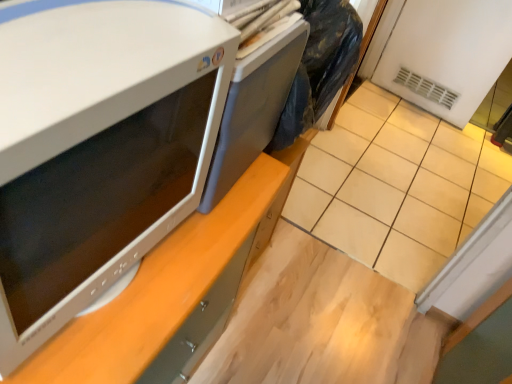
Question: Can you confirm if white glossy microwave at left is wider than satin gray desktop at center?

Choices:
 (A) no
 (B) yes

Answer: (A)

Question: Is white glossy microwave at left far from satin gray desktop at center?

Choices:
 (A) no
 (B) yes

Answer: (A)

Question: Is white glossy microwave at left to the right of satin gray desktop at center from the viewer's perspective?

Choices:
 (A) yes
 (B) no

Answer: (B)

Question: Is white glossy microwave at left with satin gray desktop at center?

Choices:
 (A) no
 (B) yes

Answer: (A)

Question: Could you tell me if white glossy microwave at left is turned towards satin gray desktop at center?

Choices:
 (A) yes
 (B) no

Answer: (B)

Question: Considering the positions of beige tile at lower right and satin gray desktop at center in the image, is beige tile at lower right taller or shorter than satin gray desktop at center?

Choices:
 (A) tall
 (B) short

Answer: (A)

Question: Is beige tile at lower right bigger or smaller than satin gray desktop at center?

Choices:
 (A) big
 (B) small

Answer: (A)

Question: Considering their positions, is beige tile at lower right located in front of or behind satin gray desktop at center?

Choices:
 (A) behind
 (B) front

Answer: (A)

Question: Choose the correct answer: Is beige tile at lower right inside satin gray desktop at center or outside it?

Choices:
 (A) outside
 (B) inside

Answer: (A)

Question: Considering the positions of satin gray desktop at center and beige tile at lower right in the image, is satin gray desktop at center bigger or smaller than beige tile at lower right?

Choices:
 (A) big
 (B) small

Answer: (B)

Question: Considering the positions of satin gray desktop at center and beige tile at lower right in the image, is satin gray desktop at center taller or shorter than beige tile at lower right?

Choices:
 (A) short
 (B) tall

Answer: (A)

Question: Is satin gray desktop at center situated inside beige tile at lower right or outside?

Choices:
 (A) outside
 (B) inside

Answer: (A)

Question: Based on their positions, is satin gray desktop at center located to the left or right of beige tile at lower right?

Choices:
 (A) left
 (B) right

Answer: (A)

Question: Looking at their shapes, would you say white glossy microwave at left is wider or thinner than beige tile at lower right?

Choices:
 (A) wide
 (B) thin

Answer: (A)

Question: Is white glossy microwave at left in front of or behind beige tile at lower right in the image?

Choices:
 (A) front
 (B) behind

Answer: (A)